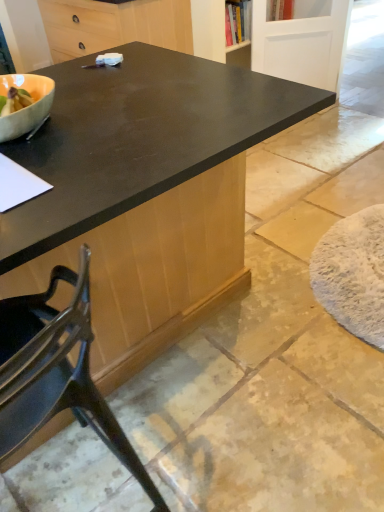
The width and height of the screenshot is (384, 512). Find the location of `free space in front of white painted wood screen door at upper right`. free space in front of white painted wood screen door at upper right is located at coordinates (333, 133).